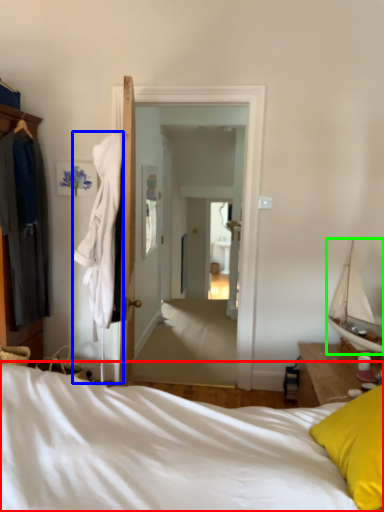
Question: Considering the real-world distances, which object is closest to bed (highlighted by a red box)? clothing (highlighted by a blue box) or boat (highlighted by a green box).

Choices:
 (A) clothing
 (B) boat

Answer: (A)